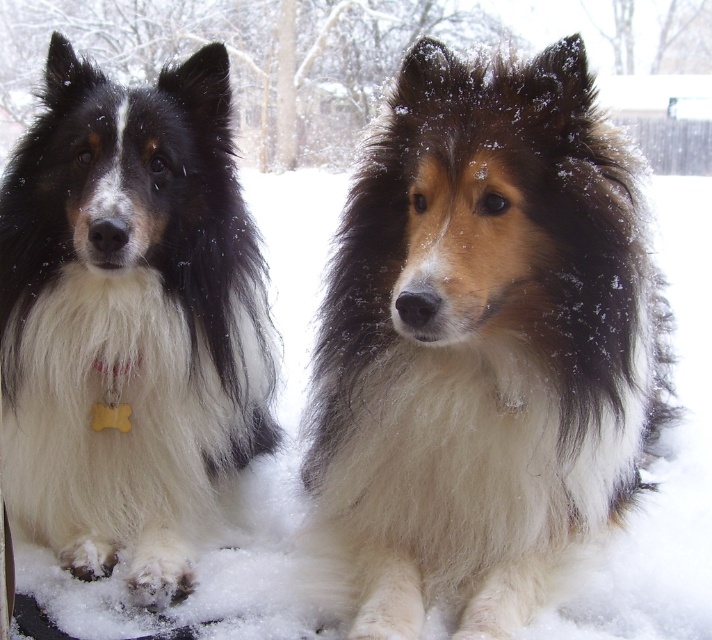
You are standing in the snowy area and want to locate the fluffy white dog at center. What are the coordinates where you should look?

The fluffy white dog at center is located at coordinates point (481,346).

You are standing at the point marked by the coordinates point [627,218]. You want to throw a snowball to a friend who is 1.5 meters away from you. Will your friend be within reach if you throw the snowball?

The point [627,218] and viewer are 1.59 meters apart. Since your friend is 1.5 meters away from you, the snowball can reach them as 1.5 meters is within the 1.59 meters distance between you and the point.